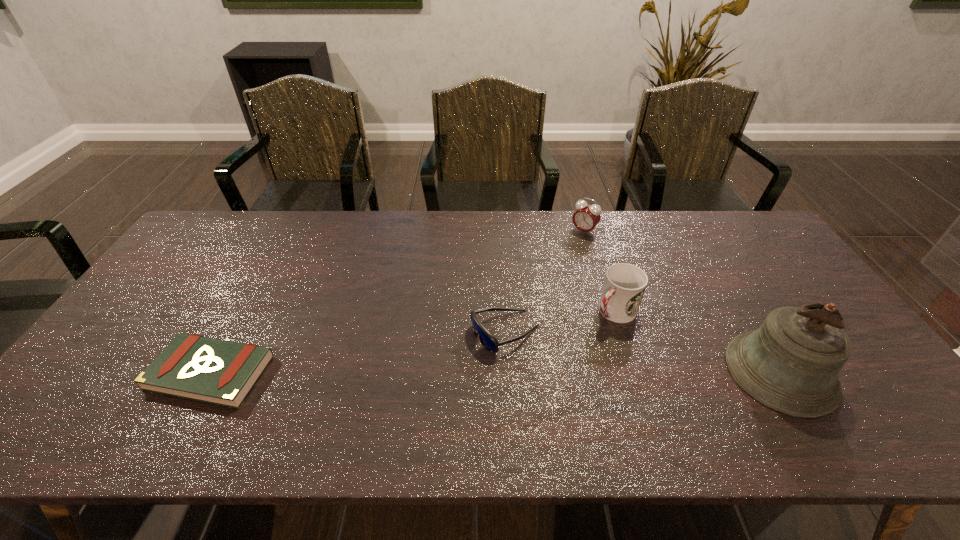
The height and width of the screenshot is (540, 960). What are the coordinates of `free location that satisfies the following two spatial constraints: 1. on the front side of the tallest object; 2. on the right side of the second object from left to right` in the screenshot? It's located at (507, 372).

Where is `free spot that satisfies the following two spatial constraints: 1. on the back side of the fourth object from right to left; 2. on the right side of the cup`? The image size is (960, 540). free spot that satisfies the following two spatial constraints: 1. on the back side of the fourth object from right to left; 2. on the right side of the cup is located at coordinates (504, 312).

The image size is (960, 540). In order to click on vacant space that satisfies the following two spatial constraints: 1. on the back side of the shortest object; 2. on the left side of the rightmost object in this screenshot , I will do `click(211, 372)`.

Identify the location of vacant space that satisfies the following two spatial constraints: 1. on the back side of the leftmost object; 2. on the left side of the cup. 244,312.